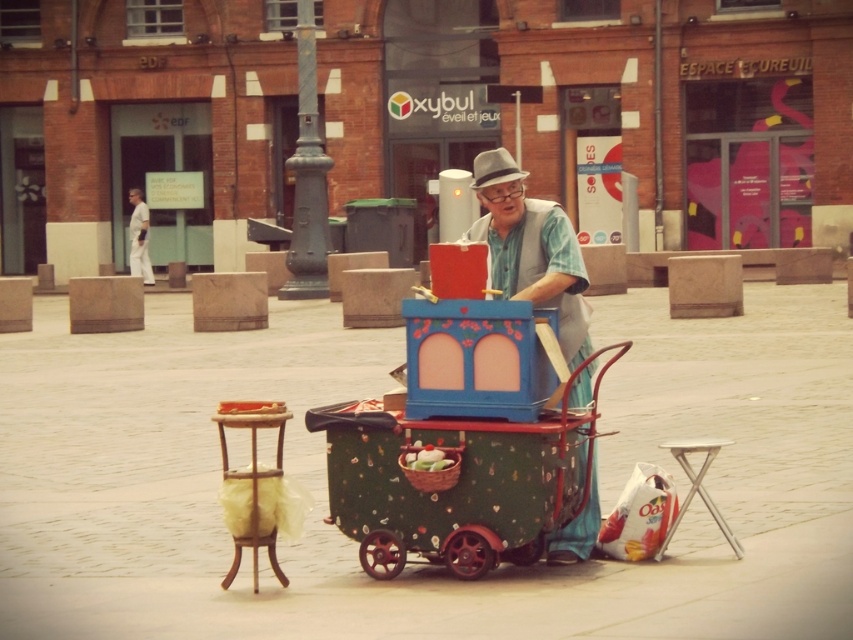
Question: Is the position of matte blue cart at center more distant than that of gray felt hat at center?

Choices:
 (A) no
 (B) yes

Answer: (A)

Question: Does green painted wood cart at center appear over matte blue cart at center?

Choices:
 (A) yes
 (B) no

Answer: (B)

Question: Which object is the closest to the matte blue cart at center?

Choices:
 (A) green woven basket at center
 (B) white cotton shirt at upper left

Answer: (A)

Question: Can you confirm if green painted wood cart at center is positioned below white cotton shirt at upper left?

Choices:
 (A) no
 (B) yes

Answer: (B)

Question: Which point appears closest to the camera in this image?

Choices:
 (A) (576, 358)
 (B) (428, 458)

Answer: (B)

Question: Which point is farther to the camera?

Choices:
 (A) (144, 240)
 (B) (514, 166)
 (C) (593, 524)
 (D) (575, 468)

Answer: (A)